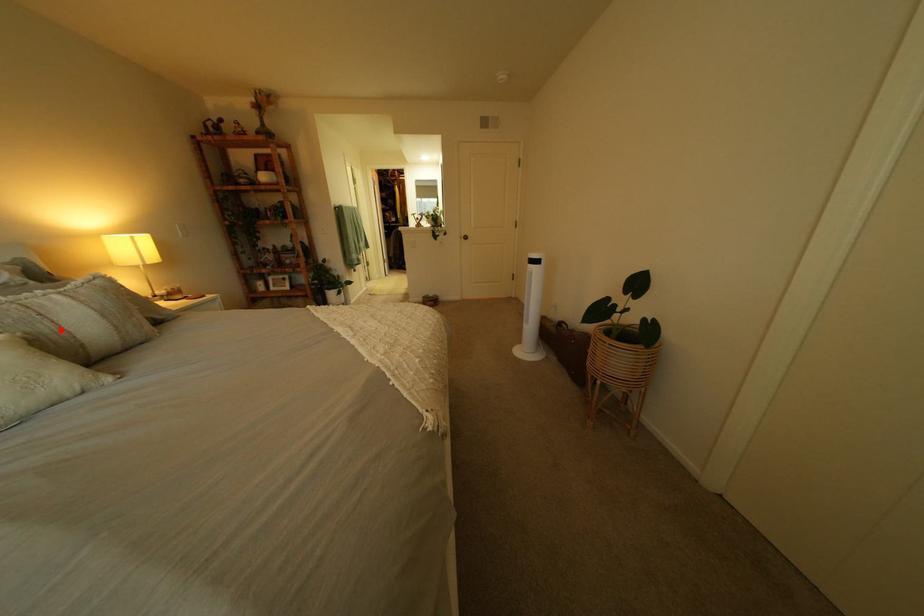
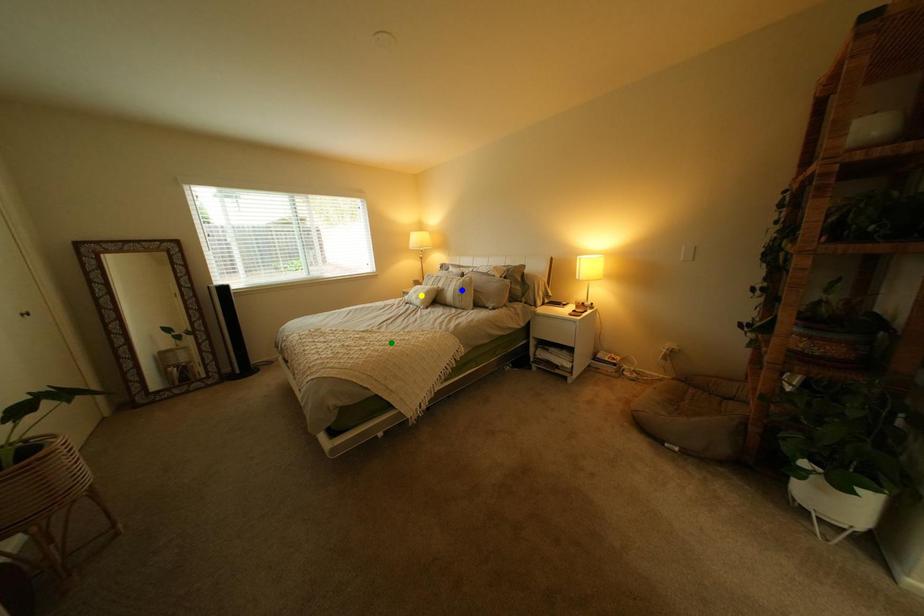
Question: I am providing you with two images of the same scene from different viewpoints. A red point is marked on the first image. You are given multiple points on the second image. Which point in image 2 represents the same 3d spot as the red point in image 1?

Choices:
 (A) yellow point
 (B) green point
 (C) blue point

Answer: (C)